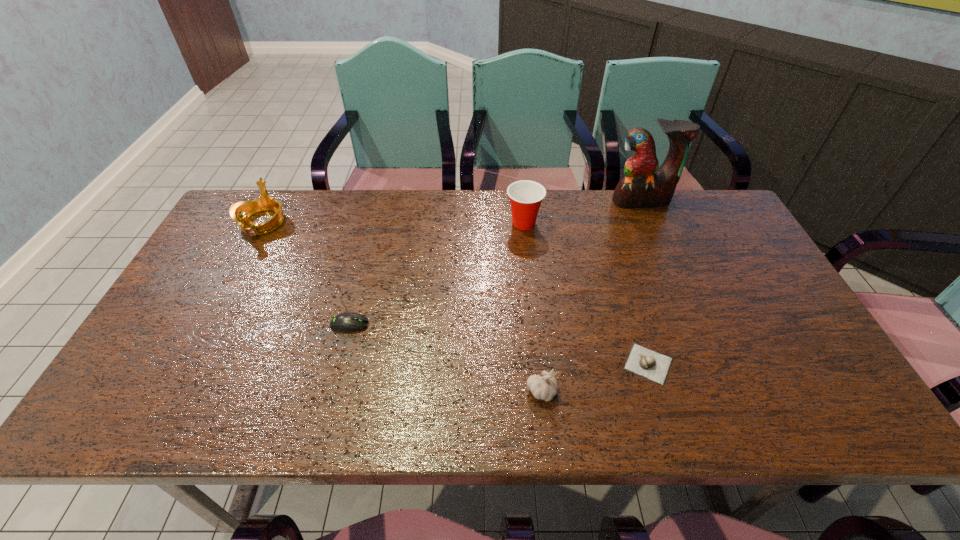
Find the location of a particular element. This screenshot has height=540, width=960. the tallest object is located at coordinates (644, 184).

At what (x,y) coordinates should I click in order to perform the action: click on cup. Please return your answer as a coordinate pair (x, y). The image size is (960, 540). Looking at the image, I should click on (526, 196).

In order to click on tiara in this screenshot , I will do `click(240, 211)`.

Identify the location of the left garlic. Image resolution: width=960 pixels, height=540 pixels. (545, 387).

The image size is (960, 540). I want to click on the third shortest object, so click(x=545, y=387).

Find the location of `the fourth farthest object`. the fourth farthest object is located at coordinates (345, 322).

At what (x,y) coordinates should I click in order to perform the action: click on the fifth object from right to left. Please return your answer as a coordinate pair (x, y). The height and width of the screenshot is (540, 960). Looking at the image, I should click on (345, 322).

Locate an element on the screen. the shorter garlic is located at coordinates tap(641, 361).

The image size is (960, 540). What are the coordinates of `the right garlic` in the screenshot? It's located at (641, 361).

Identify the location of vacant space located 0.370m at the face of the parrot. (681, 294).